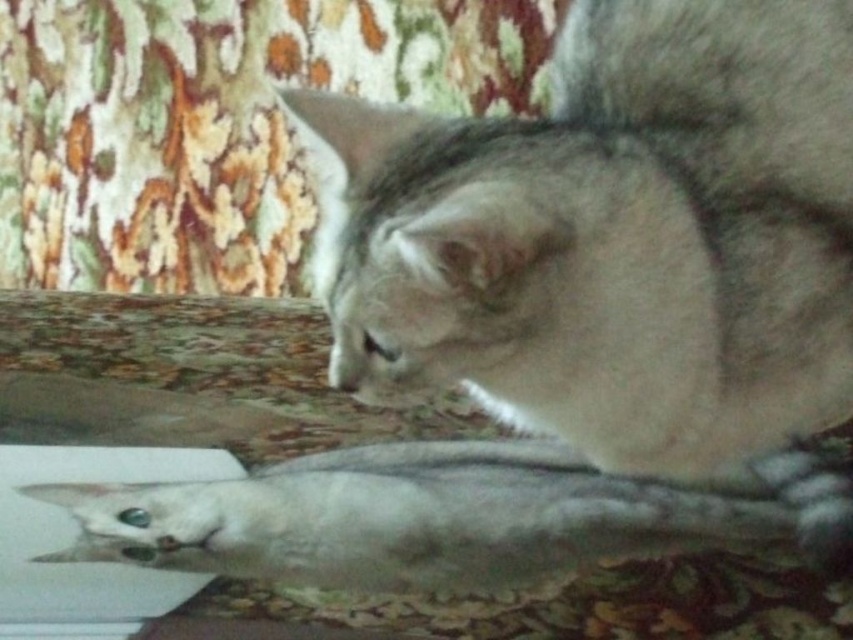
You are a photographer trying to capture the perfect shot of the cats. The point representing the fuzzy white cat at center is located at coordinates point (616, 237). If you want to position the cat in the center of your camera frame, which direction should you move the camera? Please answer with either left, right, up, or down.

The point representing the fuzzy white cat at center is already at coordinates point (616, 237). Since the cat is already at the center, you do not need to move the camera.

You are standing in front of the image. Where is the fuzzy white cat at center located in terms of coordinates?

The fuzzy white cat at center is located at coordinates point (616, 237).

You are a photographer trying to capture a clear photo of the white matte fish at lower center. However, the fuzzy white cat at center is blocking your view. Can you move the cat to the side so you can take the photo?

The fuzzy white cat at center is in front of the white matte fish at lower center, so moving the cat to the side would allow you to see the white matte fish at lower center clearly.